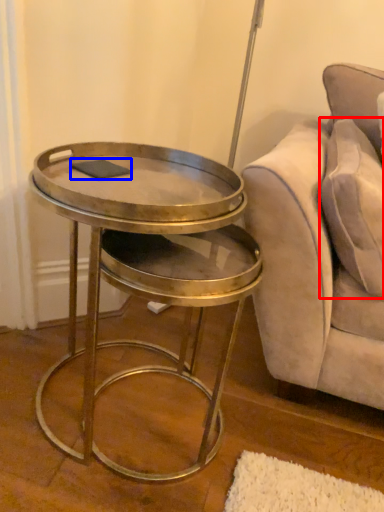
Question: Which object is further to the camera taking this photo, pillow (highlighted by a red box) or pad (highlighted by a blue box)?

Choices:
 (A) pillow
 (B) pad

Answer: (B)